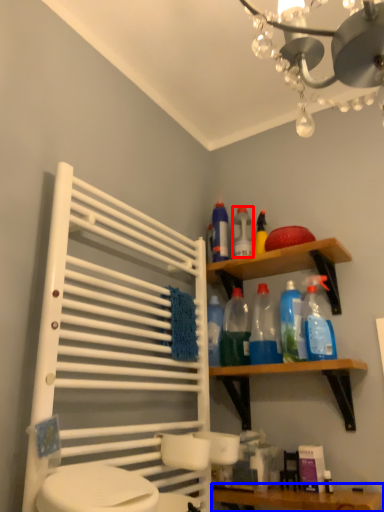
Question: Which point is closer to the camera, bottle (highlighted by a red box) or vanity (highlighted by a blue box)?

Choices:
 (A) bottle
 (B) vanity

Answer: (B)